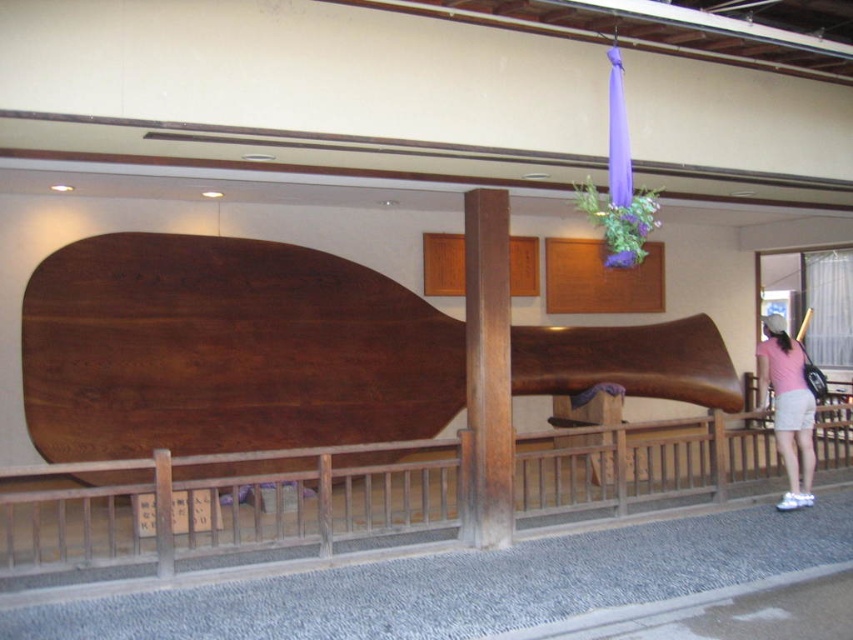
Is shiny brown wooden boat at center taller than pink fabric at lower right?

Indeed, shiny brown wooden boat at center has a greater height compared to pink fabric at lower right.

Does point (77, 262) come in front of point (779, 353)?

Yes, it is in front of point (779, 353).

The width and height of the screenshot is (853, 640). I want to click on shiny brown wooden boat at center, so click(x=225, y=349).

Where is `shiny brown wooden boat at center`? The height and width of the screenshot is (640, 853). shiny brown wooden boat at center is located at coordinates (225, 349).

Does point (457, 392) come behind point (492, 509)?

Yes, it is behind point (492, 509).

Between point (250, 314) and point (489, 285), which one is positioned in front?

Positioned in front is point (489, 285).

This screenshot has height=640, width=853. I want to click on shiny brown wooden boat at center, so click(225, 349).

What do you see at coordinates (486, 372) in the screenshot? The width and height of the screenshot is (853, 640). I see `brown polished wood at center` at bounding box center [486, 372].

Does point (477, 444) come closer to viewer compared to point (763, 401)?

Yes, it is in front of point (763, 401).

Where is `brown polished wood at center`? The width and height of the screenshot is (853, 640). brown polished wood at center is located at coordinates (486, 372).